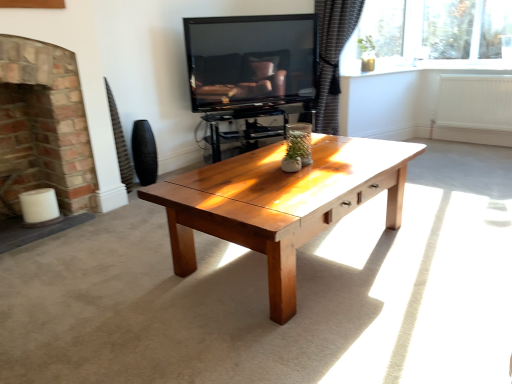
Locate an element on the screen. The image size is (512, 384). free space above white painted radiator at right (from a real-world perspective) is located at coordinates (475, 76).